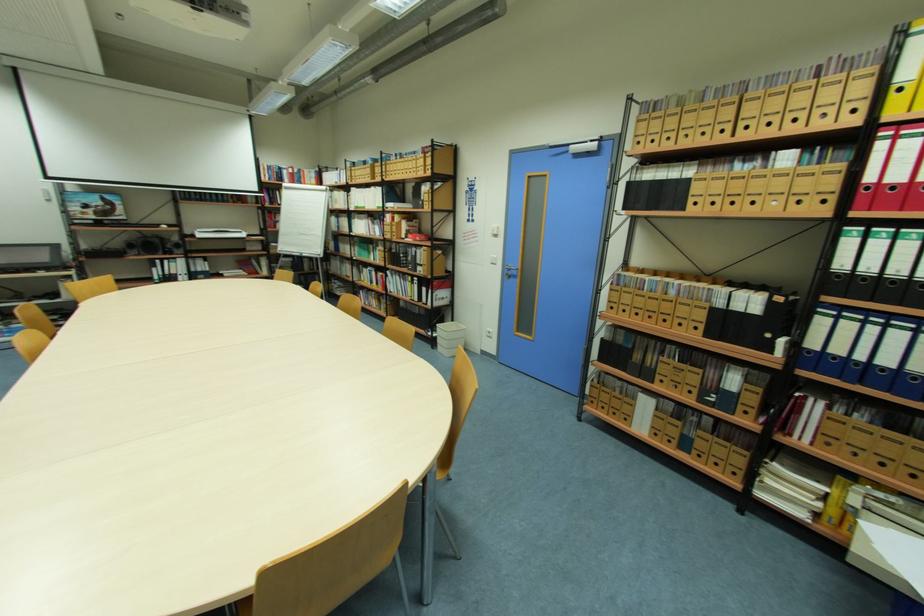
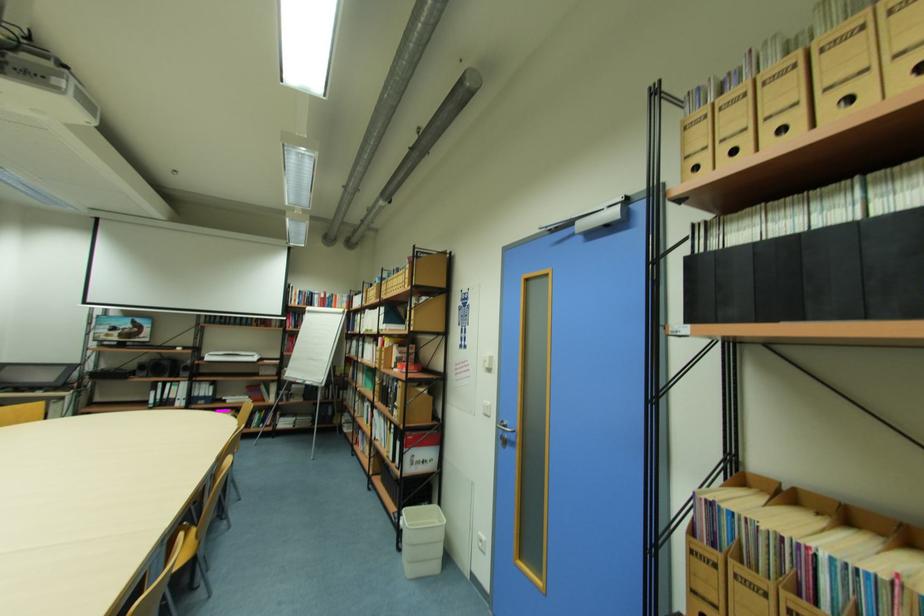
What movement of the cameraman would produce the second image?

The cameraman walked toward right, forward.